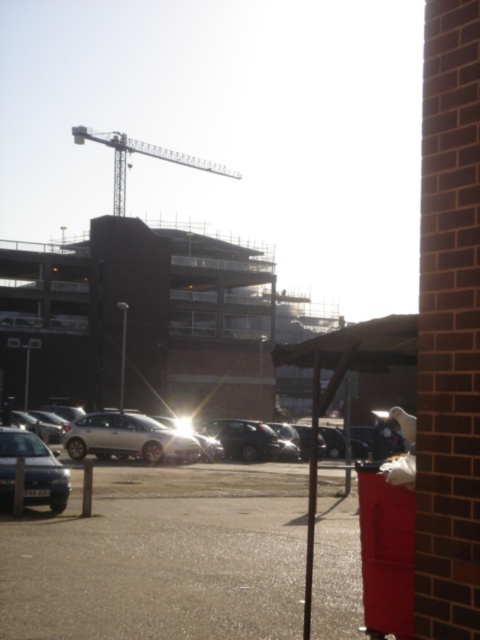
Question: Is shiny silver sedan at lower left above metallic silver crane at upper center?

Choices:
 (A) yes
 (B) no

Answer: (B)

Question: Based on their relative distances, which object is nearer to the shiny silver sedan at lower left?

Choices:
 (A) metallic silver crane at upper center
 (B) metallic silver car at lower left
 (C) metallic pole at center

Answer: (B)

Question: Which point is farther to the camera?

Choices:
 (A) metallic pole at center
 (B) metallic silver car at lower left
 (C) metallic silver crane at upper center
 (D) satin silver car at center

Answer: (C)

Question: Which of the following is the closest to the observer?

Choices:
 (A) metallic pole at center
 (B) satin silver car at center

Answer: (A)

Question: Does metallic silver car at lower left appear over metallic pole at center?

Choices:
 (A) no
 (B) yes

Answer: (B)

Question: Is satin silver car at center below shiny silver sedan at lower left?

Choices:
 (A) no
 (B) yes

Answer: (B)